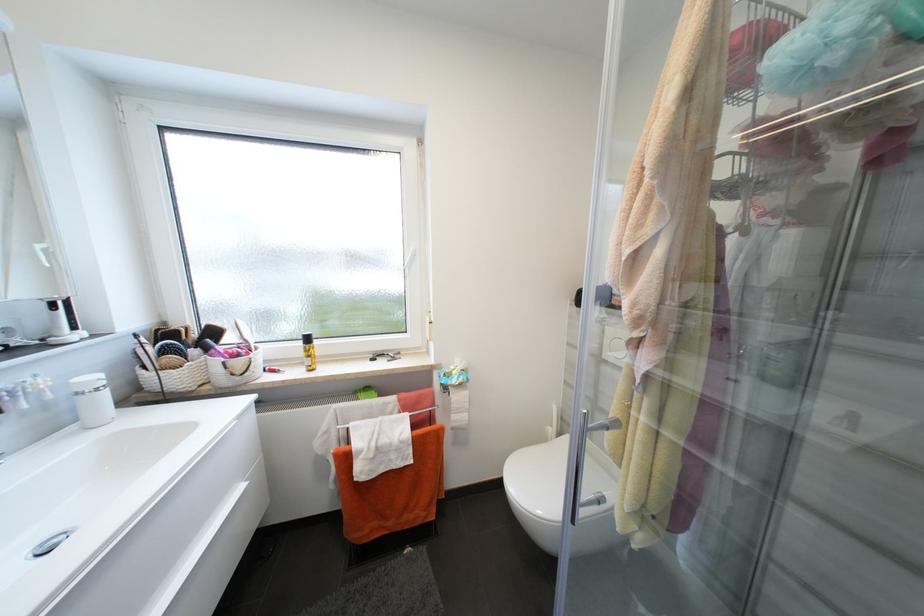
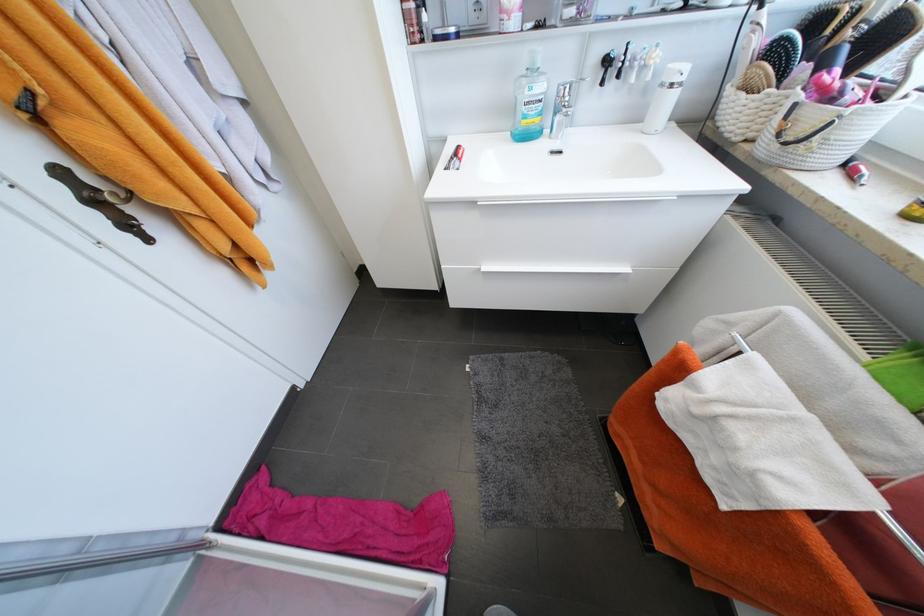
In the second image, find the point that corresponds to point 83,395 in the first image.

(667, 86)